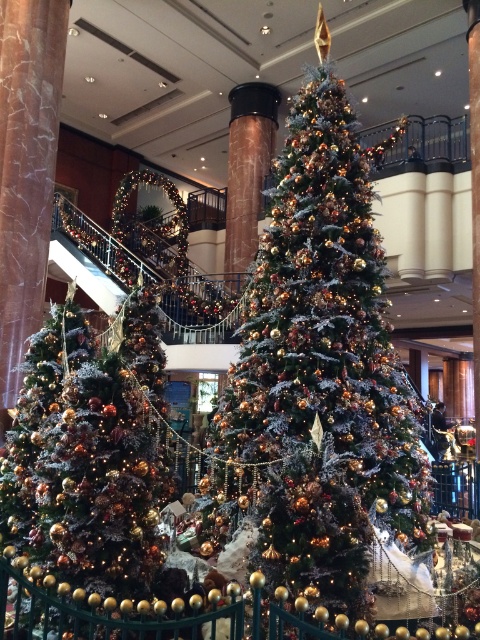
You are standing in the Christmas display and want to place a new decoration between the frosted glass christmas tree at center and the shiny gold ornaments at center. Based on their positions, which object should you move closer to the left to create space?

The frosted glass christmas tree at center is to the right of the shiny gold ornaments at center. To create space between them, you should move the frosted glass christmas tree at center closer to the left.

You are a Christmas decoration installer who needs to place a new 70 cm wide wreath between the frosted glass christmas tree at center and the shiny gold ornaments at center. Can the wreath fit in the space between them?

The distance between the frosted glass christmas tree at center and the shiny gold ornaments at center is 73.20 centimeters. Since the wreath is 70 cm wide, it can fit in the space between them as the distance is slightly larger than the wreath.